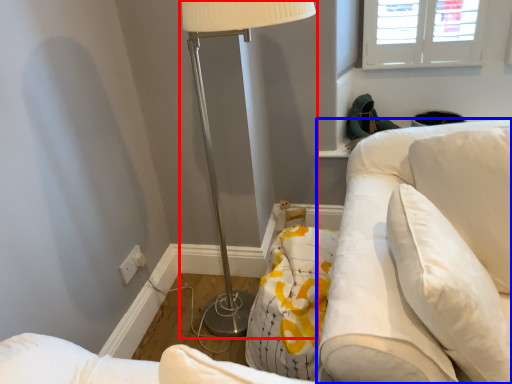
Question: Among these objects, which one is farthest to the camera, lamp (highlighted by a red box) or swivel chair (highlighted by a blue box)?

Choices:
 (A) lamp
 (B) swivel chair

Answer: (B)